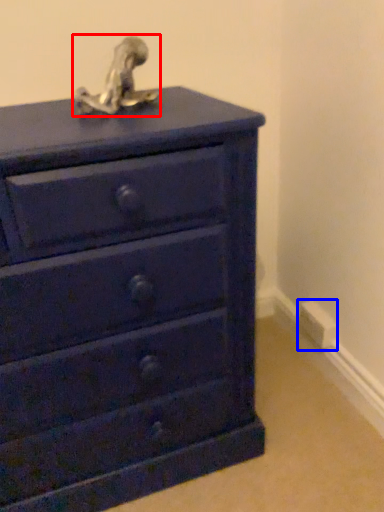
Question: Which point is further to the camera, sculpture (highlighted by a red box) or electric outlet (highlighted by a blue box)?

Choices:
 (A) sculpture
 (B) electric outlet

Answer: (B)